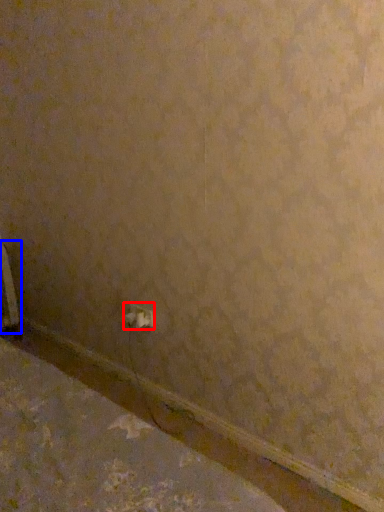
Question: Which of the following is the farthest to the observer, power plugs and sockets (highlighted by a red box) or radiator (highlighted by a blue box)?

Choices:
 (A) power plugs and sockets
 (B) radiator

Answer: (B)